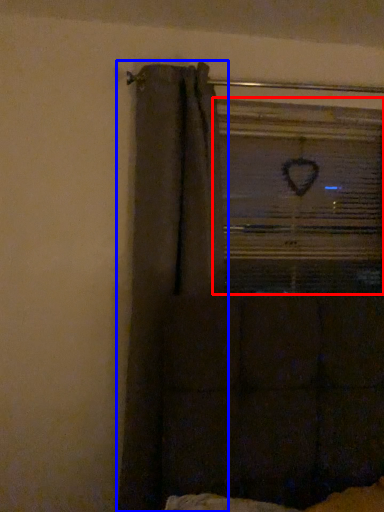
Question: Among these objects, which one is nearest to the camera, window frame (highlighted by a red box) or curtain (highlighted by a blue box)?

Choices:
 (A) window frame
 (B) curtain

Answer: (B)